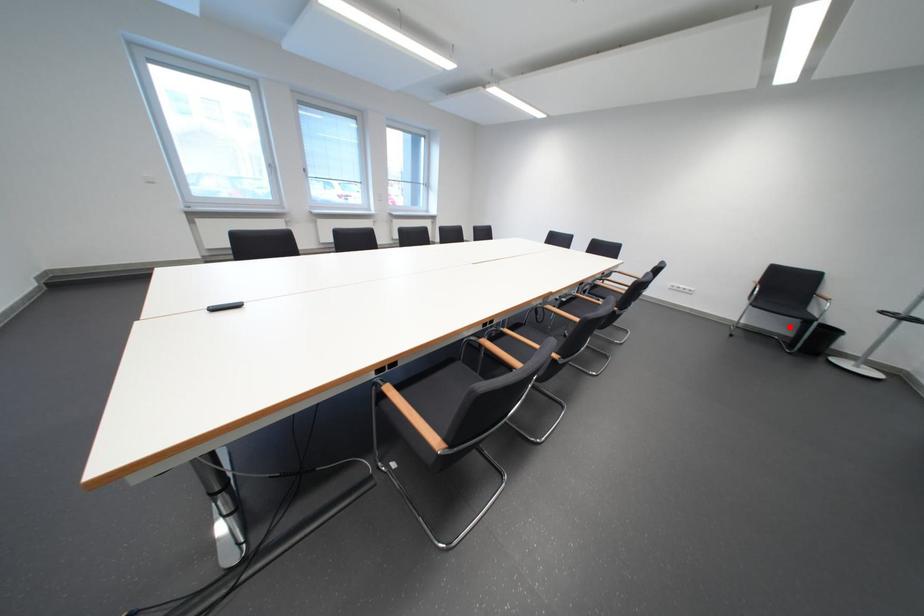
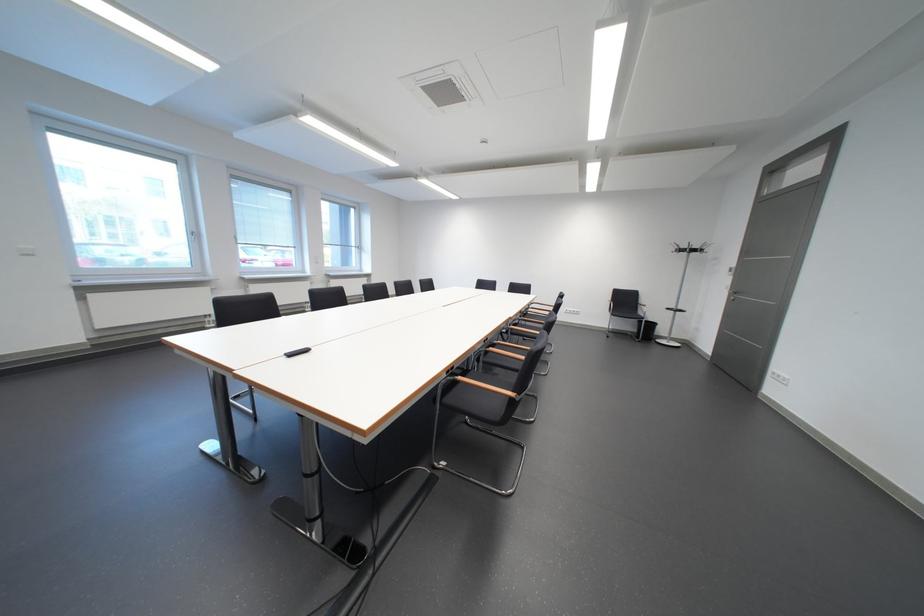
Question: I am providing you with two images of the same scene from different viewpoints. A red point is marked on the first image. Is the red point's position out of view in image 2?

Choices:
 (A) Yes
 (B) No

Answer: (B)